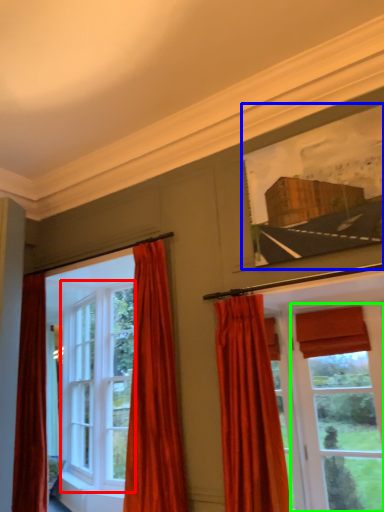
Question: Which is farther away from window (highlighted by a red box)? picture frame (highlighted by a blue box) or window (highlighted by a green box)?

Choices:
 (A) picture frame
 (B) window

Answer: (A)